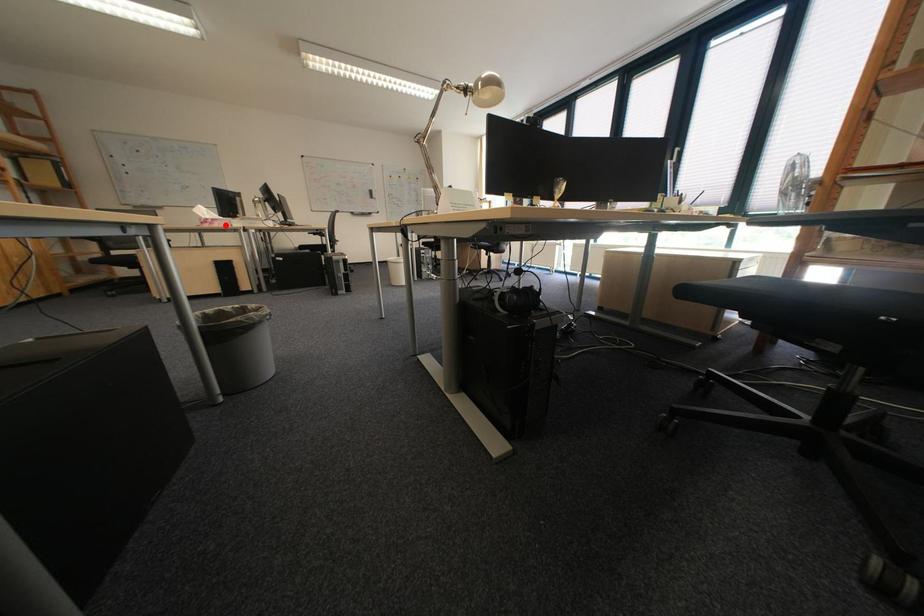
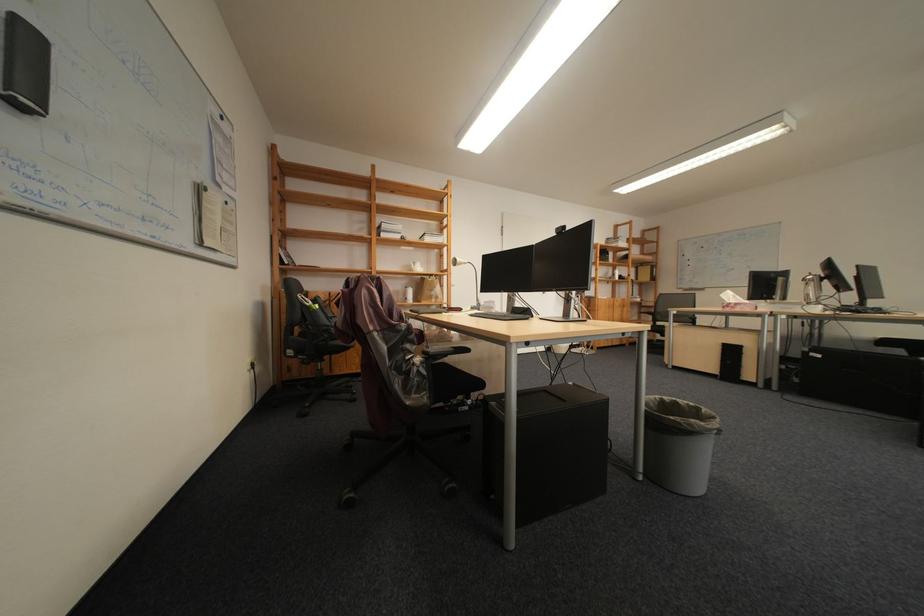
Find the pixel in the second image that matches the highlighted location in the first image.

(747, 309)